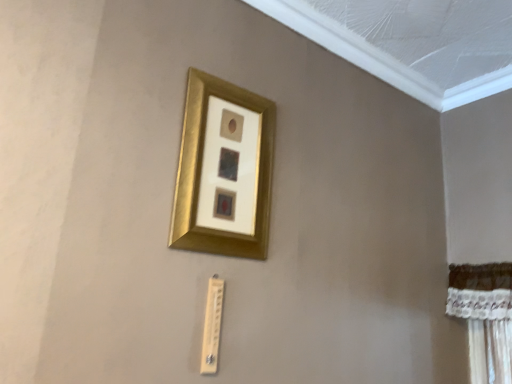
Question: Is wooden thermometer at lower center situated inside gold metallic picture frame at upper center or outside?

Choices:
 (A) outside
 (B) inside

Answer: (A)

Question: From a real-world perspective, relative to gold metallic picture frame at upper center, is wooden thermometer at lower center vertically above or below?

Choices:
 (A) above
 (B) below

Answer: (B)

Question: Looking at the image, does wooden thermometer at lower center seem bigger or smaller compared to gold metallic picture frame at upper center?

Choices:
 (A) big
 (B) small

Answer: (B)

Question: Is gold metallic picture frame at upper center inside or outside of wooden thermometer at lower center?

Choices:
 (A) inside
 (B) outside

Answer: (B)

Question: From the image's perspective, is gold metallic picture frame at upper center above or below wooden thermometer at lower center?

Choices:
 (A) above
 (B) below

Answer: (A)

Question: Looking at their shapes, would you say gold metallic picture frame at upper center is wider or thinner than wooden thermometer at lower center?

Choices:
 (A) thin
 (B) wide

Answer: (B)

Question: Would you say gold metallic picture frame at upper center is to the left or to the right of wooden thermometer at lower center in the picture?

Choices:
 (A) left
 (B) right

Answer: (B)